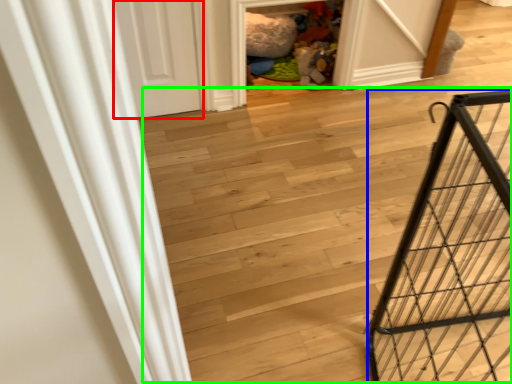
Question: Which object is positioned farthest from door (highlighted by a red box)? Select from cage (highlighted by a blue box) and stairwell (highlighted by a green box).

Choices:
 (A) cage
 (B) stairwell

Answer: (A)